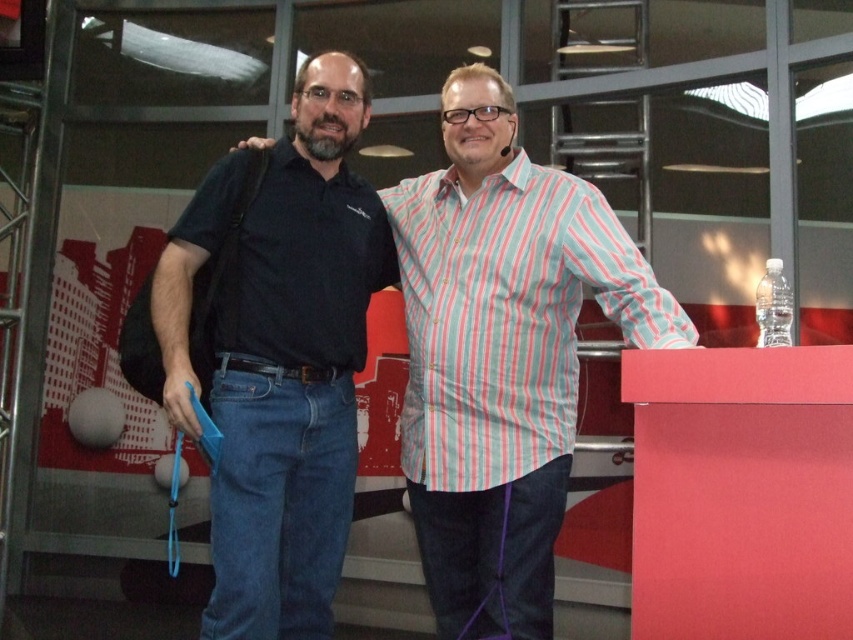
Between matte black shirt at center and black matte shirt at center, which one is positioned lower?

matte black shirt at center is lower down.

Does point (531, 208) lie in front of point (212, 173)?

That is False.

Image resolution: width=853 pixels, height=640 pixels. I want to click on matte black shirt at center, so click(x=502, y=355).